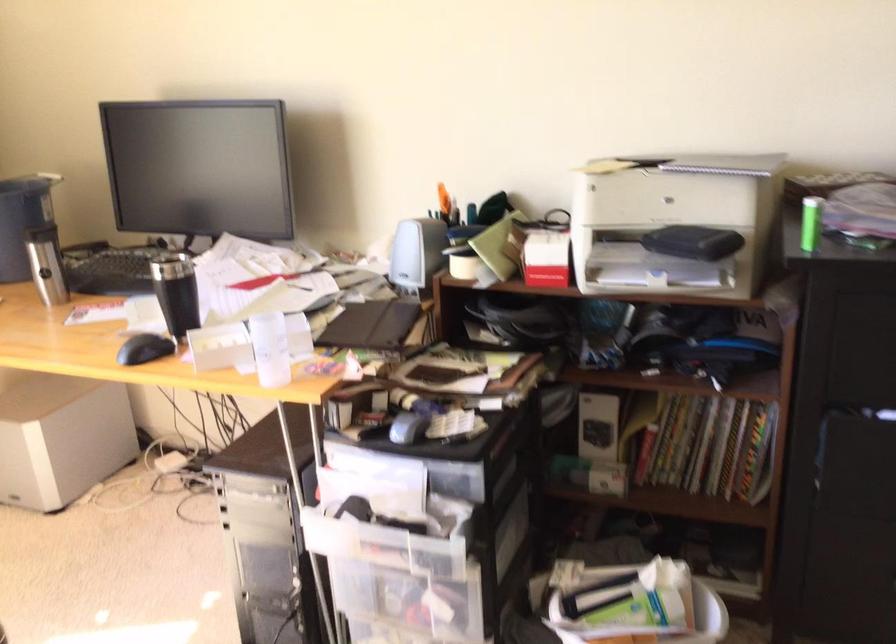
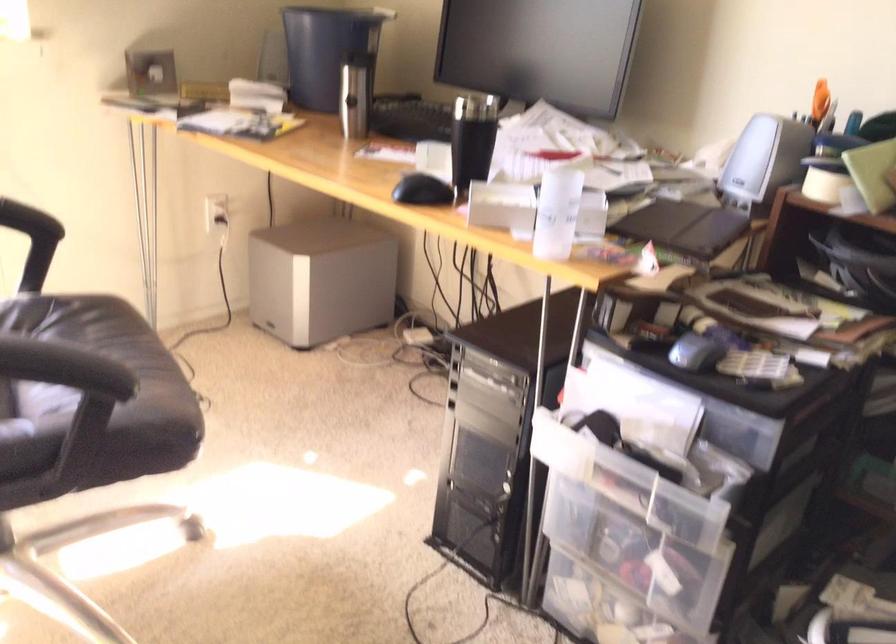
Question: The camera is either moving clockwise (left) or counter-clockwise (right) around the object. The first image is from the beginning of the video and the second image is from the end. Is the camera moving left or right when shooting the video?

Choices:
 (A) Left
 (B) Right

Answer: (B)